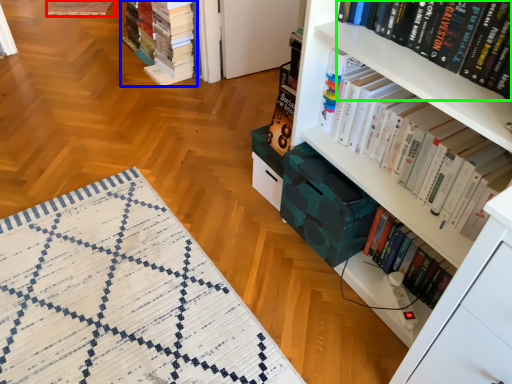
Question: Which object is the closest to the quilt (highlighted by a red box)? Choose among these: book (highlighted by a blue box) or book (highlighted by a green box).

Choices:
 (A) book
 (B) book

Answer: (A)